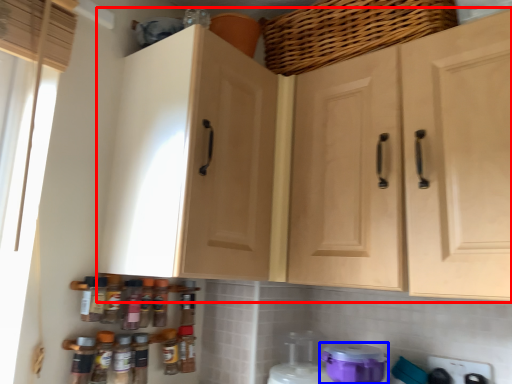
Question: Among these objects, which one is farthest to the camera, cabinetry (highlighted by a red box) or appliance (highlighted by a blue box)?

Choices:
 (A) cabinetry
 (B) appliance

Answer: (B)